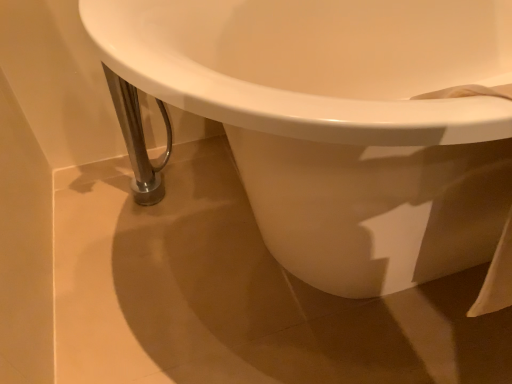
Describe the element at coordinates (339, 124) in the screenshot. This screenshot has width=512, height=384. I see `white glossy bathtub at center` at that location.

Find the location of a particular element. This screenshot has height=384, width=512. white glossy bathtub at center is located at coordinates tap(339, 124).

You are a GUI agent. You are given a task and a screenshot of the screen. Output one action in this format:
    pyautogui.click(x=<x>, y=<y>)
    Task: Click on the white glossy bathtub at center
    
    Given the screenshot: What is the action you would take?
    pyautogui.click(x=339, y=124)